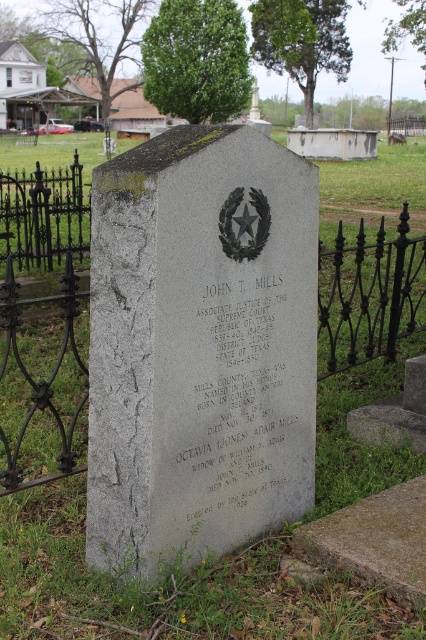
Question: In this image, where is black wrought iron fence at left located relative to iron/black metal fence at center?

Choices:
 (A) below
 (B) above

Answer: (A)

Question: Which point is closer to the camera taking this photo?

Choices:
 (A) (247, 464)
 (B) (57, 403)
 (C) (74, 456)

Answer: (A)

Question: Can you confirm if gray stone gravestone at center is smaller than gray stone plaque at center?

Choices:
 (A) yes
 (B) no

Answer: (B)

Question: Which point is farther to the camera?

Choices:
 (A) (339, 356)
 (B) (299, 406)
 (C) (331, 385)

Answer: (A)

Question: Which point is farther to the camera?

Choices:
 (A) (213, 481)
 (B) (374, 253)
 (C) (26, 449)
 (D) (351, 356)

Answer: (B)

Question: Is iron/black metal fence at center behind gray stone plaque at center?

Choices:
 (A) no
 (B) yes

Answer: (B)